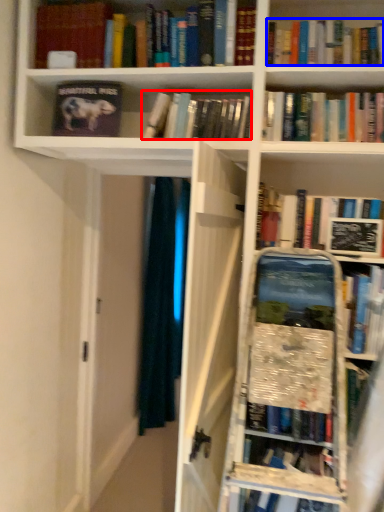
Question: Which object appears farthest to the camera in this image, book (highlighted by a red box) or book (highlighted by a blue box)?

Choices:
 (A) book
 (B) book

Answer: (A)